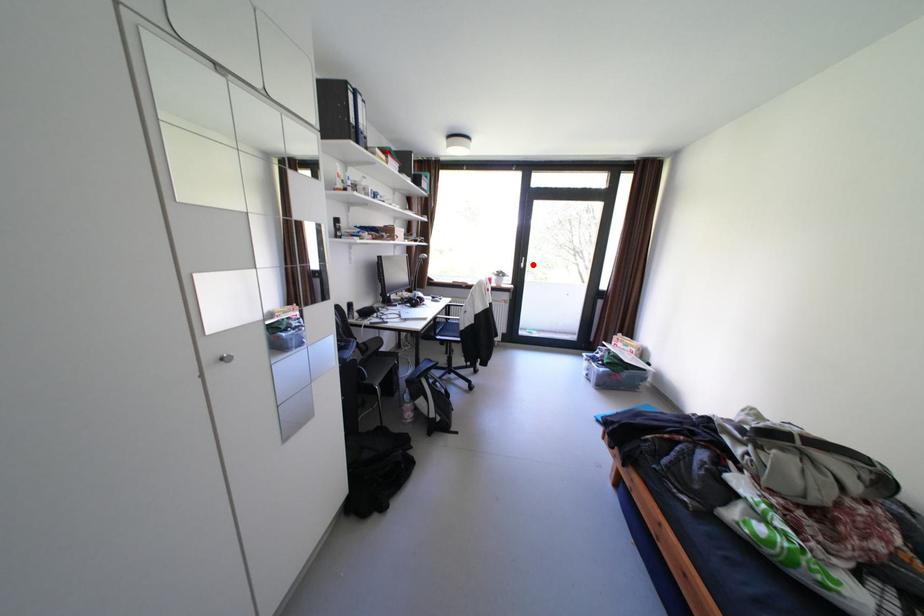
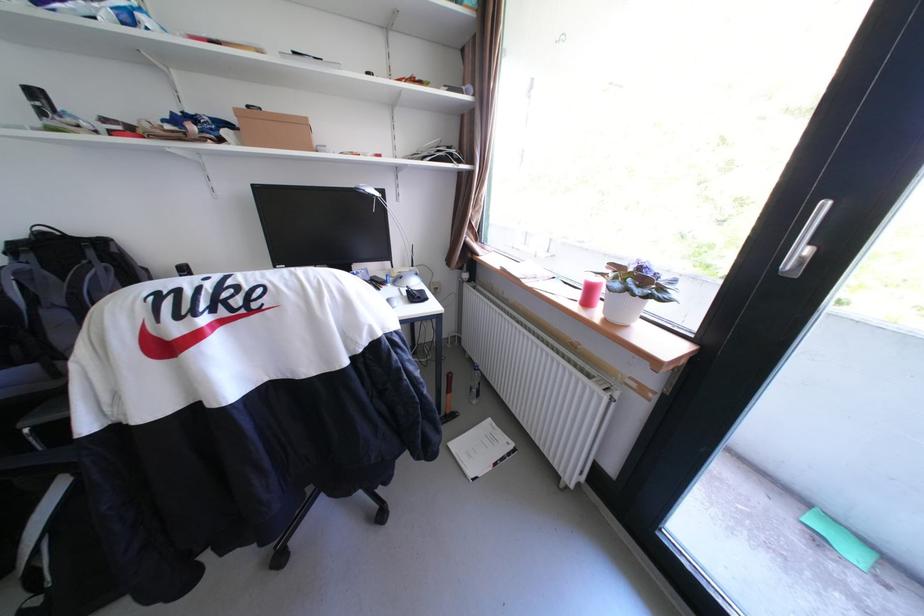
Question: I am providing you with two images of the same scene from different viewpoints. Image1 has a red point marked. In image2, the corresponding 3D location appears at what relative position? Reply with the corresponding letter.

Choices:
 (A) Closer
 (B) Farther

Answer: (B)